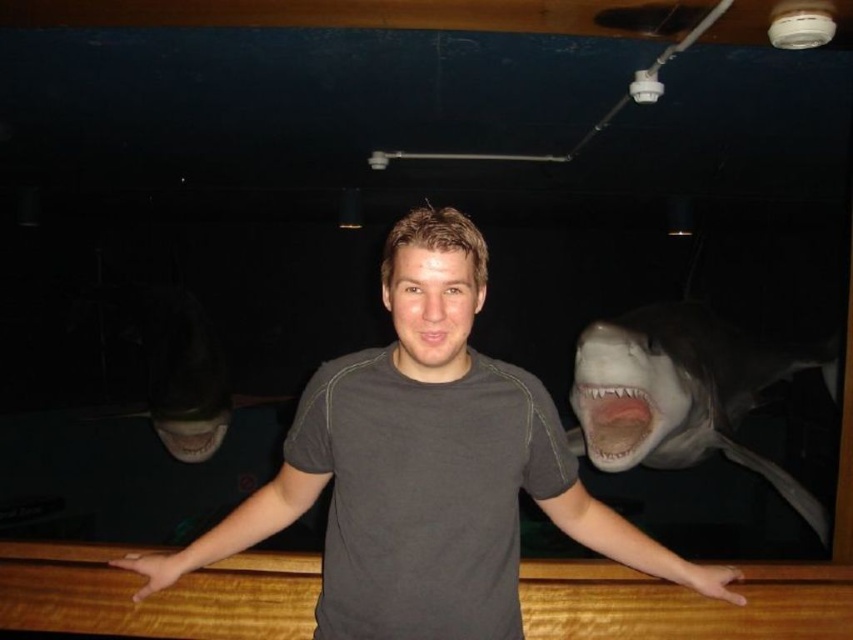
You are a photographer setting up a shot. The subject is standing with their arms on a wooden surface. You want to ensure the white glossy shark at right is centered in the frame. Where should you position the shark?

The white glossy shark at right is already positioned at point (679, 394), which is the center of the frame.

You are standing in the room and want to move from the point at coordinates point (670, 451) to point (415, 337). Can you walk directly between them without any obstacles?

Point (670, 451) is behind point (415, 337), so there is an obstacle blocking the direct path between them. You cannot walk directly between them without moving around the obstacle.